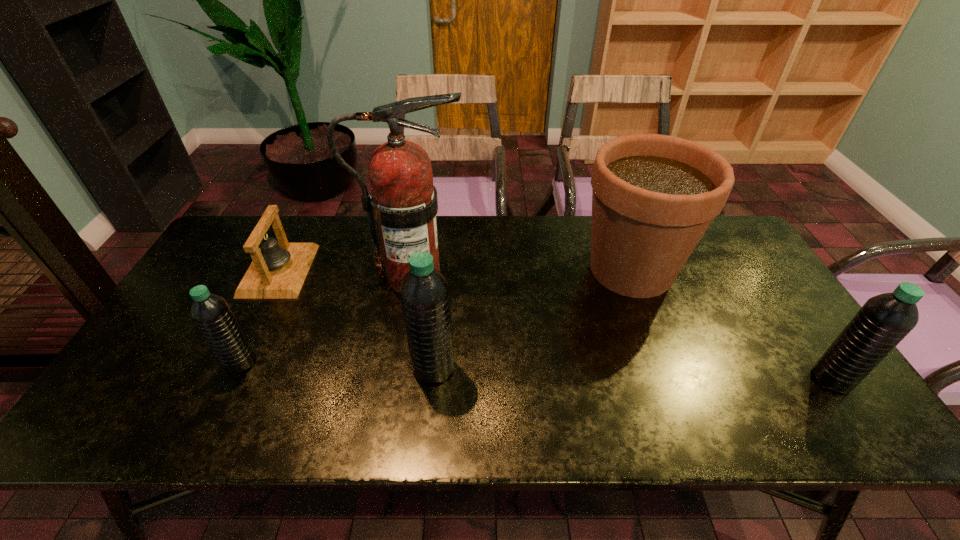
Locate an element on the screen. object at the near right corner is located at coordinates (884, 320).

You are a GUI agent. You are given a task and a screenshot of the screen. Output one action in this format:
    pyautogui.click(x=<x>, y=<y>)
    Task: Click on the free space at the far edge of the desktop
    This screenshot has width=960, height=540.
    Given the screenshot: What is the action you would take?
    pyautogui.click(x=369, y=249)

I want to click on free space at the near edge, so click(x=371, y=371).

Find the location of `vacant position at the left edge of the desktop`. vacant position at the left edge of the desktop is located at coordinates (232, 266).

This screenshot has height=540, width=960. I want to click on vacant space at the right edge of the desktop, so click(x=761, y=327).

Locate an element on the screen. blank space at the far left corner of the desktop is located at coordinates (251, 222).

You are a GUI agent. You are given a task and a screenshot of the screen. Output one action in this format:
    pyautogui.click(x=<x>, y=<y>)
    Task: Click on the vacant space at the near left corner of the desktop
    This screenshot has width=960, height=540.
    Given the screenshot: What is the action you would take?
    pyautogui.click(x=172, y=372)

Locate an element on the screen. free space between the bell and the rightmost water bottle is located at coordinates (556, 325).

You are a GUI agent. You are given a task and a screenshot of the screen. Output one action in this format:
    pyautogui.click(x=<x>, y=<y>)
    Task: Click on the vacant point located between the bell and the tallest object
    Image resolution: width=960 pixels, height=540 pixels.
    Given the screenshot: What is the action you would take?
    pyautogui.click(x=347, y=273)

Where is `vacant area that lies between the fire extinguisher and the second shortest object`? vacant area that lies between the fire extinguisher and the second shortest object is located at coordinates (327, 319).